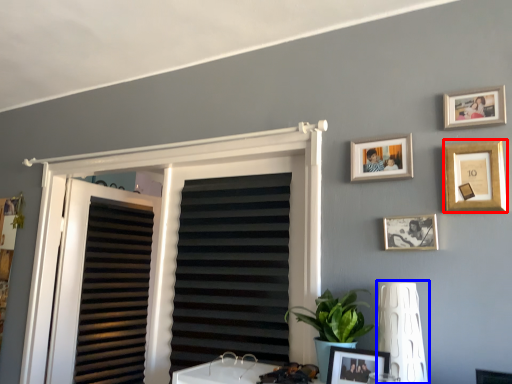
Question: Which object is closer to the camera taking this photo, picture frame (highlighted by a red box) or lamp (highlighted by a blue box)?

Choices:
 (A) picture frame
 (B) lamp

Answer: (B)